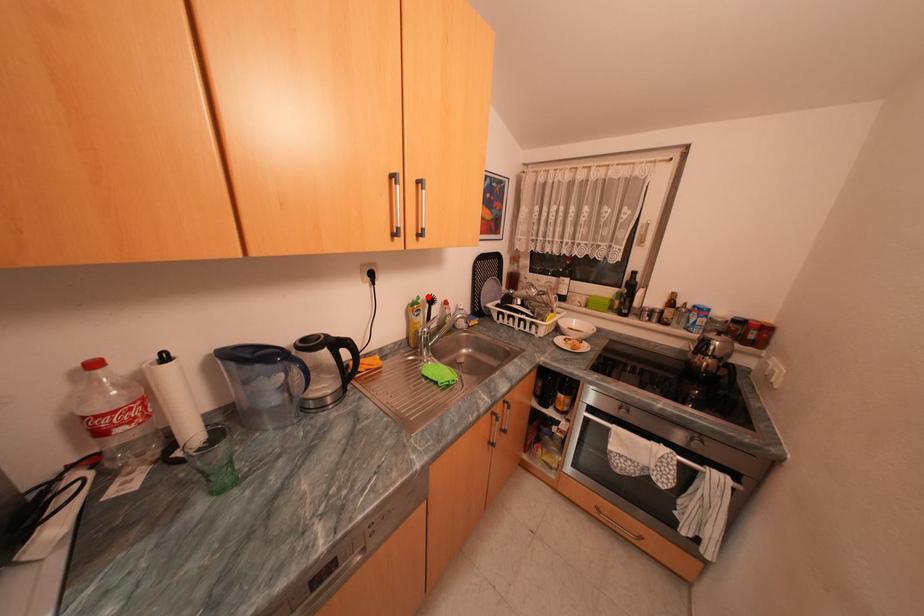
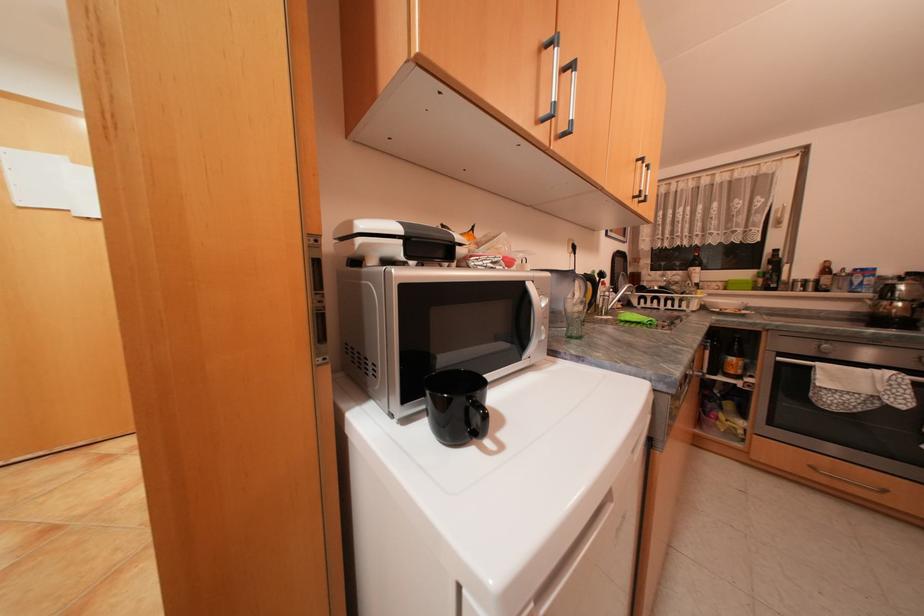
Where in the second image is the point corresponding to the highlighted location from the first image?

(602, 270)